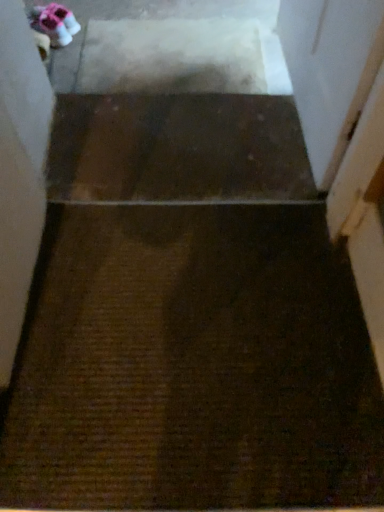
Question: Considering the positions of point (238, 156) and point (339, 41), is point (238, 156) closer or farther from the camera than point (339, 41)?

Choices:
 (A) farther
 (B) closer

Answer: (A)

Question: Is brown textured carpet at center in front of or behind transparent plastic screen door at upper right in the image?

Choices:
 (A) behind
 (B) front

Answer: (A)

Question: Which object is positioned farthest from the matte pink fabric shoe at upper left?

Choices:
 (A) brown textured carpet at center
 (B) transparent plastic screen door at upper right

Answer: (B)

Question: Considering the real-world distances, which object is farthest from the transparent plastic screen door at upper right?

Choices:
 (A) brown textured carpet at center
 (B) matte pink fabric shoe at upper left

Answer: (B)